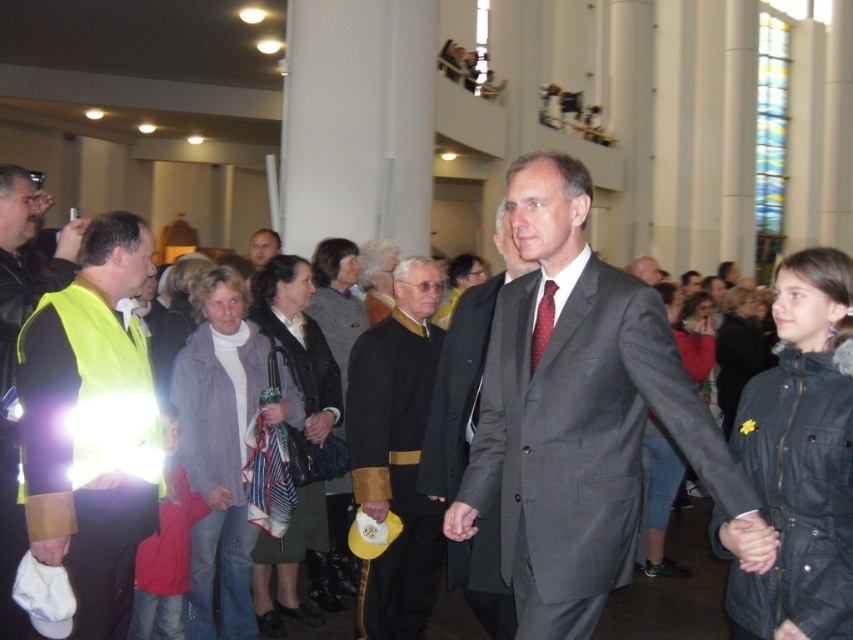
Locate an element on the screen. This screenshot has width=853, height=640. high-visibility yellow vest at left is located at coordinates (91, 426).

Does high-visibility yellow vest at left have a greater width compared to gray wool suit at center?

Incorrect, high-visibility yellow vest at left's width does not surpass gray wool suit at center's.

Measure the distance between point (32, 358) and camera.

Point (32, 358) and camera are 16.34 meters apart.

Locate an element on the screen. high-visibility yellow vest at left is located at coordinates (91, 426).

Does matte gray suit at center appear on the left side of red dotted tie at center?

Correct, you'll find matte gray suit at center to the left of red dotted tie at center.

Does point (527, 305) come behind point (534, 369)?

Yes.

Who is more forward, (618,563) or (531,348)?

Point (618,563) is in front.

Image resolution: width=853 pixels, height=640 pixels. Identify the location of matte gray suit at center. (576, 413).

Does black velvet robe at center have a greater width compared to red dotted tie at center?

Indeed, black velvet robe at center has a greater width compared to red dotted tie at center.

Who is taller, black velvet robe at center or red dotted tie at center?

With more height is black velvet robe at center.

Where is `black velvet robe at center`? black velvet robe at center is located at coordinates (396, 452).